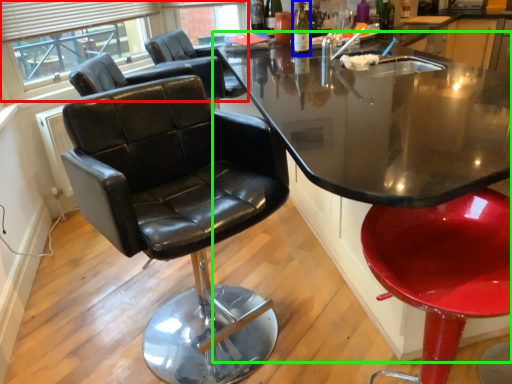
Question: Which object is positioned farthest from bay window (highlighted by a red box)? Select from bottle (highlighted by a blue box) and table (highlighted by a green box).

Choices:
 (A) bottle
 (B) table

Answer: (A)